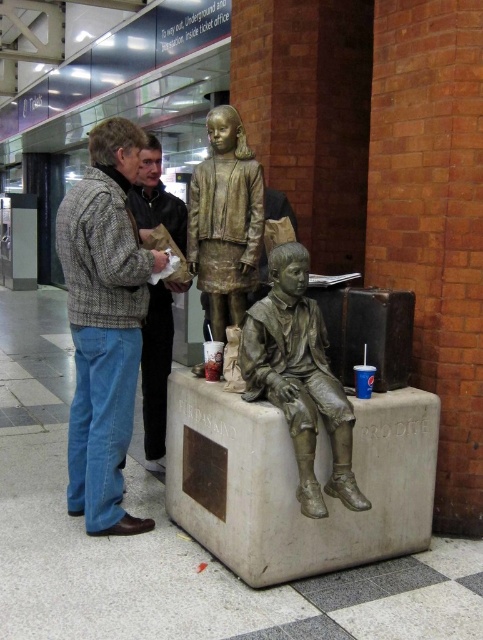
Is bronze statue at center in front of light brown leather jacket at center?

Yes, it is.

Consider the image. Can you confirm if bronze statue at center is taller than light brown leather jacket at center?

Incorrect, bronze statue at center's height is not larger of light brown leather jacket at center's.

This screenshot has height=640, width=483. In order to click on bronze statue at center in this screenshot , I will do `click(299, 378)`.

From the picture: Between gray wool sweater at left and bronze statue at center, which one appears on the right side from the viewer's perspective?

From the viewer's perspective, bronze statue at center appears more on the right side.

Who is taller, gray wool sweater at left or bronze statue at center?

gray wool sweater at left

Who is more distant from viewer, (105, 314) or (342, 456)?

The point (105, 314) is behind.

The height and width of the screenshot is (640, 483). What are the coordinates of `gray wool sweater at left` in the screenshot? It's located at (104, 323).

Consider the image. Which is above, bronze statue at upper center or light brown leather jacket at center?

bronze statue at upper center is above.

Can you confirm if bronze statue at upper center is positioned above light brown leather jacket at center?

Correct, bronze statue at upper center is located above light brown leather jacket at center.

Measure the distance between point (233,301) and camera.

Point (233,301) and camera are 3.18 meters apart.

Where is `bronze statue at upper center`? bronze statue at upper center is located at coordinates (226, 220).